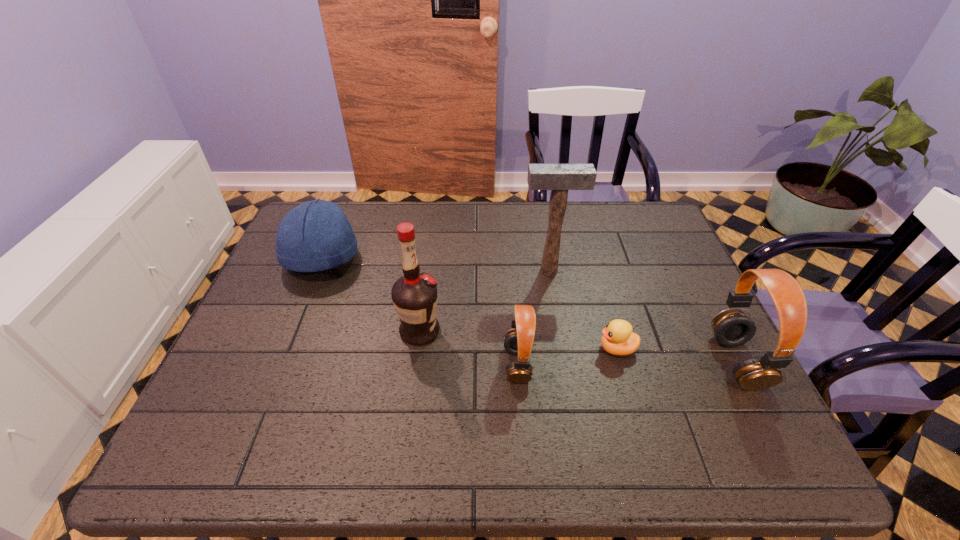
The height and width of the screenshot is (540, 960). Find the location of `object that is at the right edge`. object that is at the right edge is located at coordinates [732, 327].

At what (x,y) coordinates should I click in order to perform the action: click on object that is at the far left corner. Please return your answer as a coordinate pair (x, y). The height and width of the screenshot is (540, 960). Looking at the image, I should click on (316, 235).

Find the location of a particular element. This screenshot has height=540, width=960. object that is at the near right corner is located at coordinates (732, 327).

Locate an element on the screen. The height and width of the screenshot is (540, 960). free space at the far edge is located at coordinates (432, 232).

The width and height of the screenshot is (960, 540). In the image, there is a desktop. In order to click on vacant space at the near edge in this screenshot , I will do `click(329, 415)`.

Image resolution: width=960 pixels, height=540 pixels. In order to click on vacant space at the left edge of the desktop in this screenshot , I will do `click(276, 340)`.

Find the location of a particular element. The height and width of the screenshot is (540, 960). vacant space at the right edge is located at coordinates (665, 347).

Locate an element on the screen. free area in between the third tallest object and the liquor is located at coordinates (579, 346).

In order to click on free space between the fifth object from right to left and the fourth object from right to left in this screenshot , I will do point(468,348).

The width and height of the screenshot is (960, 540). In order to click on free space between the duckling and the skullcap in this screenshot , I will do `click(469, 303)`.